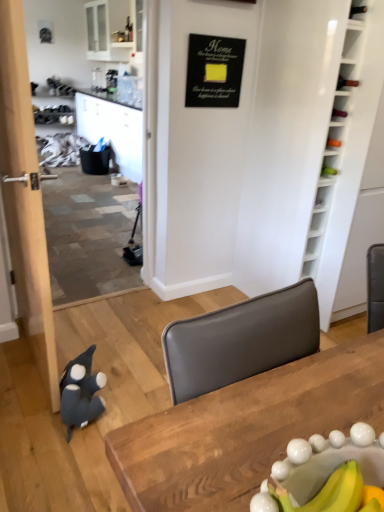
What is the approximate height of dark gray plush penguin at lower left?

dark gray plush penguin at lower left is 7.72 inches tall.

At what (x,y) coordinates should I click in order to perform the action: click on white wood bookshelf at right. Please return your answer as a coordinate pair (x, y). Looking at the image, I should click on (314, 153).

In the scene shown: Is dark gray plush penguin at lower left far from black matte signboard at upper center?

That's right, there is a large distance between dark gray plush penguin at lower left and black matte signboard at upper center.

Is dark gray plush penguin at lower left outside of black matte signboard at upper center?

dark gray plush penguin at lower left lies outside black matte signboard at upper center's area.

In order to click on penguin in front of the black matte signboard at upper center in this screenshot , I will do `click(81, 392)`.

Considering the sizes of objects dark gray plush penguin at lower left and black matte signboard at upper center in the image provided, who is thinner, dark gray plush penguin at lower left or black matte signboard at upper center?

black matte signboard at upper center is thinner.

Which object is further away from the camera taking this photo, dark gray plush penguin at lower left or wooden table at center?

dark gray plush penguin at lower left is further from the camera.

Which is correct: dark gray plush penguin at lower left is inside wooden table at center, or outside of it?

dark gray plush penguin at lower left exists outside the volume of wooden table at center.

Is point (67, 419) more distant than point (255, 425)?

Yes, point (67, 419) is farther from viewer.

From the image's perspective, between dark gray plush penguin at lower left and wooden table at center, who is located below?

wooden table at center is shown below in the image.

Consider the image. Are wooden table at center and dark gray plush penguin at lower left far apart?

Yes, wooden table at center is far from dark gray plush penguin at lower left.

From a real-world perspective, is wooden table at center physically located above or below dark gray plush penguin at lower left?

Clearly, from a real-world perspective, wooden table at center is above dark gray plush penguin at lower left.

From the image's perspective, would you say wooden table at center is shown under dark gray plush penguin at lower left?

Yes.

Does wooden table at center have a lesser height compared to dark gray plush penguin at lower left?

Incorrect, the height of wooden table at center does not fall short of that of dark gray plush penguin at lower left.

Based on their sizes in the image, would you say black matte signboard at upper center is bigger or smaller than dark gray plush penguin at lower left?

black matte signboard at upper center is smaller than dark gray plush penguin at lower left.

Locate an element on the screen. The height and width of the screenshot is (512, 384). penguin in front of the black matte signboard at upper center is located at coordinates (81, 392).

From the image's perspective, does black matte signboard at upper center appear lower than dark gray plush penguin at lower left?

Incorrect, from the image's perspective, black matte signboard at upper center is higher than dark gray plush penguin at lower left.

Relative to wooden table at center, is white wood bookshelf at right in front or behind?

Visually, white wood bookshelf at right is located behind wooden table at center.

Is white wood bookshelf at right facing away from wooden table at center?

No, white wood bookshelf at right is not facing the opposite direction of wooden table at center.

Which object is thinner, white wood bookshelf at right or wooden table at center?

With smaller width is wooden table at center.

Is white wood bookshelf at right inside the boundaries of black matte signboard at upper center, or outside?

white wood bookshelf at right lies outside black matte signboard at upper center.

Considering the sizes of objects white wood bookshelf at right and black matte signboard at upper center in the image provided, who is bigger, white wood bookshelf at right or black matte signboard at upper center?

With larger size is white wood bookshelf at right.

Could you tell me if white wood bookshelf at right is facing black matte signboard at upper center?

No, white wood bookshelf at right is not facing towards black matte signboard at upper center.

Which object is more forward, white wood bookshelf at right or black matte signboard at upper center?

Positioned in front is white wood bookshelf at right.

Does black matte signboard at upper center have a larger size compared to white wood bookshelf at right?

Incorrect, black matte signboard at upper center is not larger than white wood bookshelf at right.

Would you say black matte signboard at upper center is a long distance from white wood bookshelf at right?

No, black matte signboard at upper center is in close proximity to white wood bookshelf at right.

Which object is closer to the camera, black matte signboard at upper center or white wood bookshelf at right?

white wood bookshelf at right is closer to the camera.

Where is `bulletin board on the right side of dark gray plush penguin at lower left`? bulletin board on the right side of dark gray plush penguin at lower left is located at coordinates (214, 71).

The height and width of the screenshot is (512, 384). In the image, there is a wooden table at center. In order to click on penguin below it (from a real-world perspective) in this screenshot , I will do pyautogui.click(x=81, y=392).

From the image, which object appears to be nearer to wooden table at center, dark gray plush penguin at lower left or white wood bookshelf at right?

dark gray plush penguin at lower left lies closer to wooden table at center than the other object.

Looking at the image, which one is located closer to black matte signboard at upper center, wooden table at center or white wood bookshelf at right?

white wood bookshelf at right.

From the image, which object appears to be farther from black matte signboard at upper center, white wood bookshelf at right or wooden table at center?

wooden table at center.

Estimate the real-world distances between objects in this image. Which object is further from dark gray plush penguin at lower left, wooden table at center or black matte signboard at upper center?

black matte signboard at upper center lies further to dark gray plush penguin at lower left than the other object.

Which object lies further to the anchor point dark gray plush penguin at lower left, black matte signboard at upper center or white wood bookshelf at right?

Based on the image, black matte signboard at upper center appears to be further to dark gray plush penguin at lower left.

Based on their spatial positions, is black matte signboard at upper center or wooden table at center closer to dark gray plush penguin at lower left?

wooden table at center lies closer to dark gray plush penguin at lower left than the other object.

Based on their spatial positions, is white wood bookshelf at right or dark gray plush penguin at lower left further from black matte signboard at upper center?

dark gray plush penguin at lower left is positioned further to the anchor black matte signboard at upper center.

Considering their positions, is black matte signboard at upper center positioned closer to wooden table at center than white wood bookshelf at right?

The object closer to wooden table at center is white wood bookshelf at right.

Where is `penguin that lies between black matte signboard at upper center and wooden table at center from top to bottom`? The width and height of the screenshot is (384, 512). penguin that lies between black matte signboard at upper center and wooden table at center from top to bottom is located at coordinates (81, 392).

This screenshot has width=384, height=512. Identify the location of penguin between wooden table at center and white wood bookshelf at right along the z-axis. (81, 392).

Where is `bookshelf between wooden table at center and black matte signboard at upper center along the z-axis`? This screenshot has width=384, height=512. bookshelf between wooden table at center and black matte signboard at upper center along the z-axis is located at coordinates (314, 153).

Where is `bookshelf that lies between black matte signboard at upper center and dark gray plush penguin at lower left from top to bottom`? This screenshot has width=384, height=512. bookshelf that lies between black matte signboard at upper center and dark gray plush penguin at lower left from top to bottom is located at coordinates (314, 153).